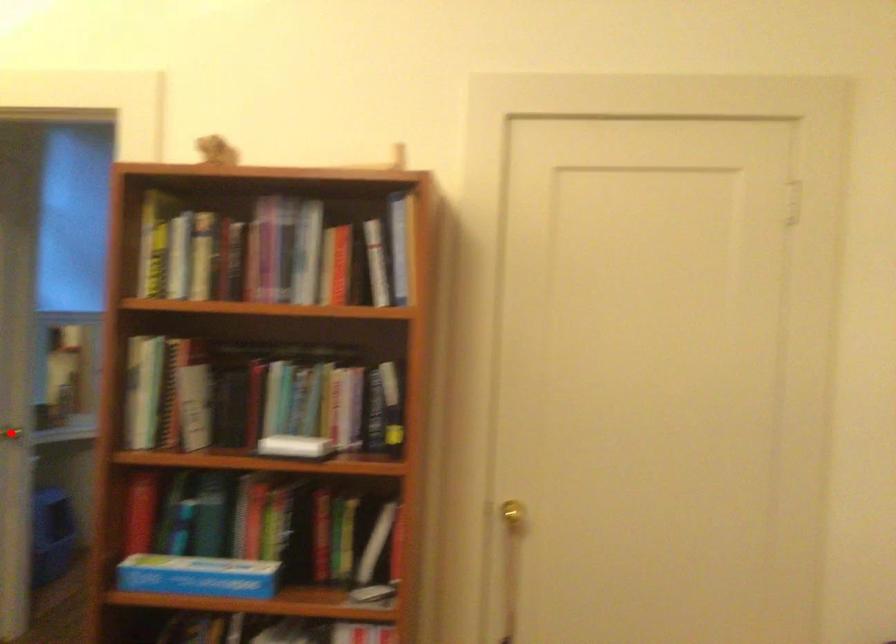
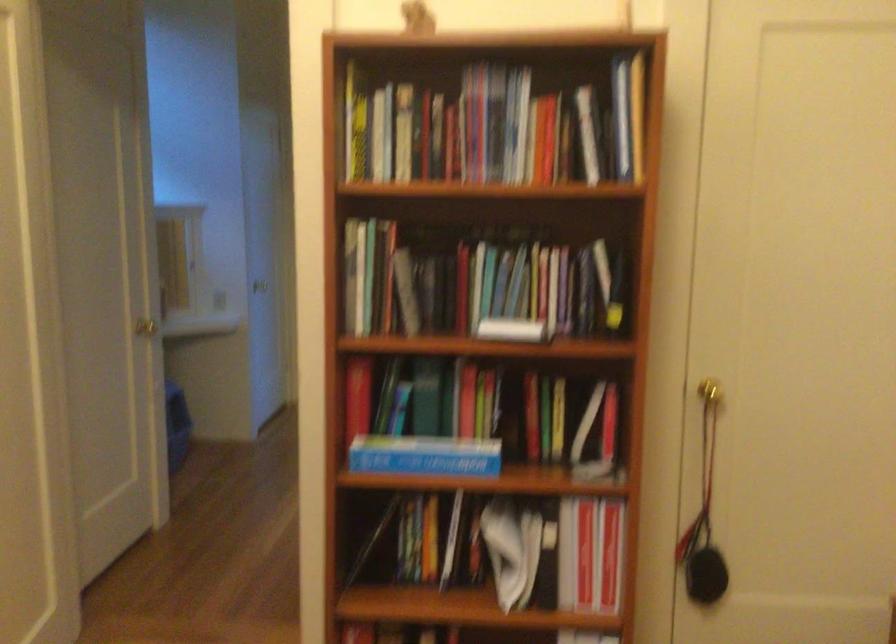
Where in the second image is the point corresponding to the highlighted location from the first image?

(164, 334)